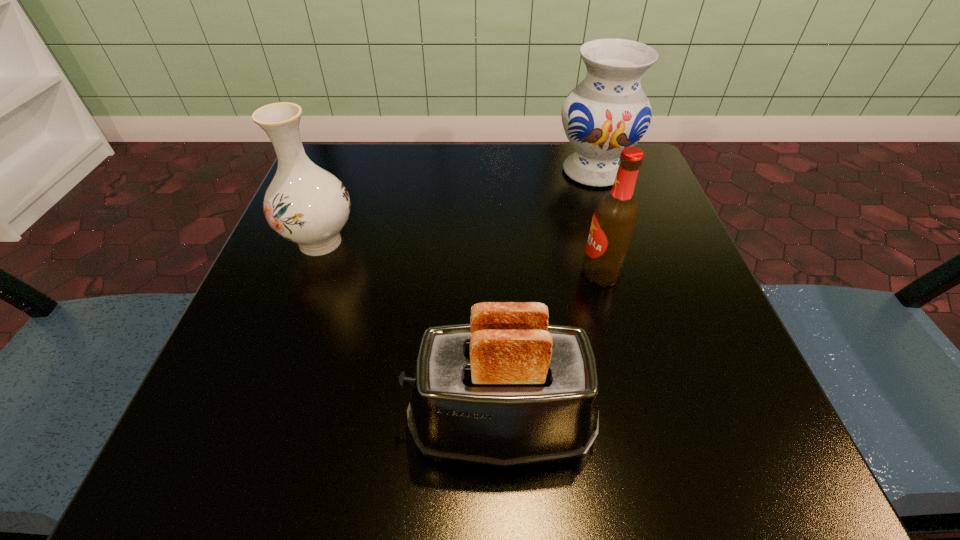
The image size is (960, 540). In order to click on free space between the right vase and the left vase in this screenshot , I will do `click(457, 206)`.

This screenshot has width=960, height=540. Find the location of `free space between the leftmost object and the farthest object`. free space between the leftmost object and the farthest object is located at coordinates (457, 206).

Locate which object ranks third in proximity to the beer bottle. Please provide its 2D coordinates. Your answer should be formatted as a tuple, i.e. [(x, y)], where the tuple contains the x and y coordinates of a point satisfying the conditions above.

[(304, 203)]

Where is `object identified as the third closest to the leftmost object`? object identified as the third closest to the leftmost object is located at coordinates (614, 220).

You are a GUI agent. You are given a task and a screenshot of the screen. Output one action in this format:
    pyautogui.click(x=<x>, y=<y>)
    Task: Click on the vacant area in the image that satisfies the following two spatial constraints: 1. on the back side of the farther vase; 2. on the left side of the leftmost object
    This screenshot has width=960, height=540.
    Given the screenshot: What is the action you would take?
    pyautogui.click(x=348, y=171)

The image size is (960, 540). In order to click on free location that satisfies the following two spatial constraints: 1. on the back side of the farther vase; 2. on the right side of the beer bottle in this screenshot , I will do `click(574, 171)`.